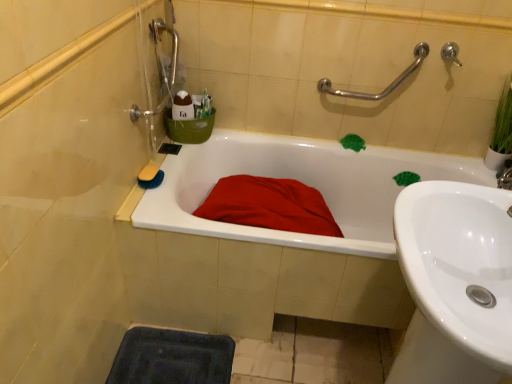
What do you see at coordinates (172, 358) in the screenshot? This screenshot has width=512, height=384. I see `dark blue rubber bath mat at lower left` at bounding box center [172, 358].

Image resolution: width=512 pixels, height=384 pixels. Describe the element at coordinates (450, 52) in the screenshot. I see `silver metallic faucet at upper right` at that location.

Where is `silver metallic grab bar at upper right`? The width and height of the screenshot is (512, 384). silver metallic grab bar at upper right is located at coordinates (386, 87).

What is the approximate width of white glossy sink at lower right?

17.11 inches.

Find the location of a particular element. matte red blanket at center is located at coordinates (269, 205).

Locate an element on the screen. This screenshot has width=512, height=384. yellow sponge at upper left is located at coordinates (148, 172).

Identify the location of dark blue rubber bath mat at lower left. This screenshot has height=384, width=512. tap(172, 358).

From the image's perspective, is silver metallic grab bar at upper right below silver metallic faucet at upper right?

Correct, silver metallic grab bar at upper right appears lower than silver metallic faucet at upper right in the image.

Is silver metallic grab bar at upper right at the right side of silver metallic faucet at upper right?

No, silver metallic grab bar at upper right is not to the right of silver metallic faucet at upper right.

Looking at their sizes, would you say silver metallic grab bar at upper right is wider or thinner than silver metallic faucet at upper right?

silver metallic grab bar at upper right is wider than silver metallic faucet at upper right.

From a real-world perspective, is dark blue rubber bath mat at lower left under silver metallic grab bar at upper right?

Yes.

Can you confirm if dark blue rubber bath mat at lower left is thinner than silver metallic grab bar at upper right?

In fact, dark blue rubber bath mat at lower left might be wider than silver metallic grab bar at upper right.

Which point is more distant from viewer, (137, 380) or (420, 57)?

Positioned behind is point (420, 57).

Considering the relative positions of dark blue rubber bath mat at lower left and silver metallic grab bar at upper right in the image provided, is dark blue rubber bath mat at lower left to the right of silver metallic grab bar at upper right from the viewer's perspective?

No.

Could you tell me if yellow sponge at upper left is facing dark blue rubber bath mat at lower left?

No, yellow sponge at upper left is not oriented towards dark blue rubber bath mat at lower left.

Considering the sizes of objects yellow sponge at upper left and dark blue rubber bath mat at lower left in the image provided, who is shorter, yellow sponge at upper left or dark blue rubber bath mat at lower left?

With less height is dark blue rubber bath mat at lower left.

Can you confirm if yellow sponge at upper left is positioned to the right of dark blue rubber bath mat at lower left?

Incorrect, yellow sponge at upper left is not on the right side of dark blue rubber bath mat at lower left.

Between yellow sponge at upper left and silver metallic grab bar at upper right, which one appears on the right side from the viewer's perspective?

From the viewer's perspective, silver metallic grab bar at upper right appears more on the right side.

You are a GUI agent. You are given a task and a screenshot of the screen. Output one action in this format:
    pyautogui.click(x=<x>, y=<y>)
    Task: Click on the soap lying below the silver metallic grab bar at upper right (from the image's perspective)
    The height and width of the screenshot is (384, 512).
    Given the screenshot: What is the action you would take?
    pyautogui.click(x=148, y=172)

From a real-world perspective, is yellow sponge at upper left above or below silver metallic grab bar at upper right?

yellow sponge at upper left is situated lower than silver metallic grab bar at upper right in the real world.

Is silver metallic grab bar at upper right oriented towards yellow sponge at upper left?

No.

Locate an element on the screen. The height and width of the screenshot is (384, 512). shower lying above the yellow sponge at upper left (from the image's perspective) is located at coordinates (386, 87).

From the image's perspective, is silver metallic grab bar at upper right on top of yellow sponge at upper left?

Correct, silver metallic grab bar at upper right appears higher than yellow sponge at upper left in the image.

Considering the sizes of objects silver metallic grab bar at upper right and yellow sponge at upper left in the image provided, who is taller, silver metallic grab bar at upper right or yellow sponge at upper left?

silver metallic grab bar at upper right.

From a real-world perspective, between yellow sponge at upper left and matte red blanket at center, who is vertically lower?

matte red blanket at center.

Is yellow sponge at upper left bigger than matte red blanket at center?

Incorrect, yellow sponge at upper left is not larger than matte red blanket at center.

From the image's perspective, is yellow sponge at upper left beneath matte red blanket at center?

No, from the image's perspective, yellow sponge at upper left is not below matte red blanket at center.

Is yellow sponge at upper left not within matte red blanket at center?

yellow sponge at upper left is positioned outside matte red blanket at center.

From the image's perspective, who appears lower, matte red blanket at center or white glossy bathtub at center?

white glossy bathtub at center is shown below in the image.

Considering the relative sizes of matte red blanket at center and white glossy bathtub at center in the image provided, is matte red blanket at center bigger than white glossy bathtub at center?

Actually, matte red blanket at center might be smaller than white glossy bathtub at center.

Which object is positioned more to the right, matte red blanket at center or white glossy bathtub at center?

white glossy bathtub at center.

This screenshot has height=384, width=512. In order to click on plumbing fixture above the silver metallic grab bar at upper right (from the image's perspective) in this screenshot , I will do `click(450, 52)`.

Find the location of a particular element. The height and width of the screenshot is (384, 512). shower on the right of the dark blue rubber bath mat at lower left is located at coordinates (386, 87).

Looking at the image, which one is located further to dark blue rubber bath mat at lower left, silver metallic grab bar at upper right or white glossy bathtub at center?

silver metallic grab bar at upper right lies further to dark blue rubber bath mat at lower left than the other object.

From the image, which object appears to be nearer to yellow sponge at upper left, white glossy sink at lower right or white glossy bathtub at center?

white glossy bathtub at center.

Looking at the image, which one is located closer to silver metallic grab bar at upper right, silver metallic faucet at upper right or white glossy sink at lower right?

Among the two, silver metallic faucet at upper right is located nearer to silver metallic grab bar at upper right.

Based on their spatial positions, is yellow sponge at upper left or dark blue rubber bath mat at lower left closer to matte red blanket at center?

Among the two, yellow sponge at upper left is located nearer to matte red blanket at center.

Looking at the image, which one is located closer to silver metallic faucet at upper right, yellow sponge at upper left or matte red blanket at center?

matte red blanket at center is closer to silver metallic faucet at upper right.

Looking at the image, which one is located closer to white glossy sink at lower right, silver metallic grab bar at upper right or silver metallic faucet at upper right?

Among the two, silver metallic grab bar at upper right is located nearer to white glossy sink at lower right.

Which object lies further to the anchor point matte red blanket at center, white glossy bathtub at center or silver metallic grab bar at upper right?

silver metallic grab bar at upper right is further to matte red blanket at center.

Looking at the image, which one is located closer to silver metallic faucet at upper right, white glossy bathtub at center or silver metallic grab bar at upper right?

silver metallic grab bar at upper right is closer to silver metallic faucet at upper right.

This screenshot has width=512, height=384. Find the location of `bathtub between silver metallic faucet at upper right and white glossy sink at lower right in the vertical direction`. bathtub between silver metallic faucet at upper right and white glossy sink at lower right in the vertical direction is located at coordinates (301, 181).

Locate an element on the screen. sink between silver metallic grab bar at upper right and dark blue rubber bath mat at lower left from top to bottom is located at coordinates (455, 283).

This screenshot has height=384, width=512. Identify the location of blanket between yellow sponge at upper left and silver metallic grab bar at upper right in the horizontal direction. (269, 205).

Identify the location of bathtub between silver metallic faucet at upper right and dark blue rubber bath mat at lower left in the vertical direction. This screenshot has height=384, width=512. (301, 181).